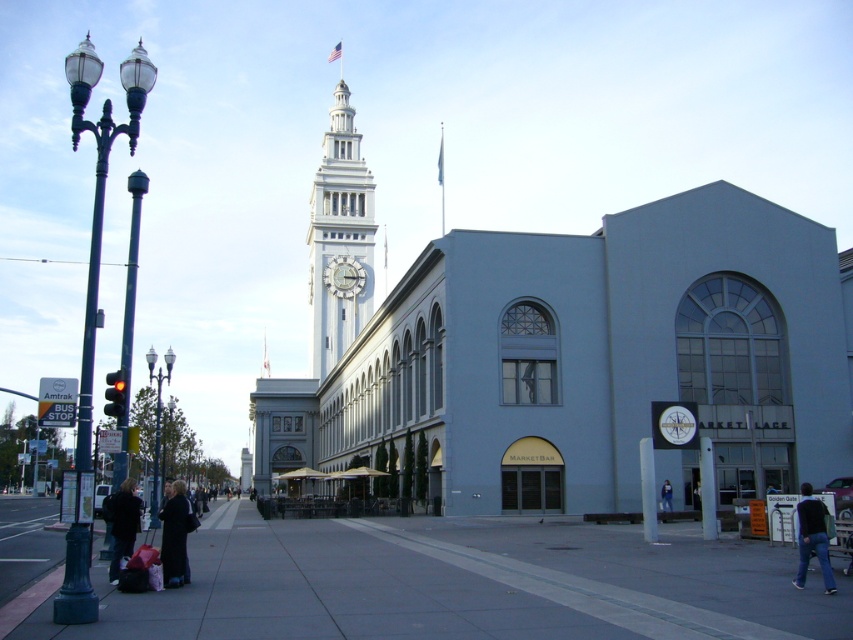
Question: Which of the following is the closest to the observer?

Choices:
 (A) (126, 528)
 (B) (318, 340)
 (C) (805, 484)

Answer: (A)

Question: Considering the real-world distances, which object is farthest from the dark blue jeans at lower right?

Choices:
 (A) green painted metal streetlight at left
 (B) gray concrete sidewalk at center

Answer: (A)

Question: Does polished metal streetlight at left lie behind denim jacket at lower right?

Choices:
 (A) yes
 (B) no

Answer: (B)

Question: Which of the following is the farthest from the observer?

Choices:
 (A) polished metal streetlight at left
 (B) dark gray coat at lower left
 (C) dark blue jeans at lower right
 (D) black glass lamp post at left

Answer: (D)

Question: Is green painted metal streetlight at left further to camera compared to dark gray jacket at lower left?

Choices:
 (A) yes
 (B) no

Answer: (B)

Question: Where is dark gray coat at lower left located in relation to denim jacket at lower right in the image?

Choices:
 (A) below
 (B) above

Answer: (B)